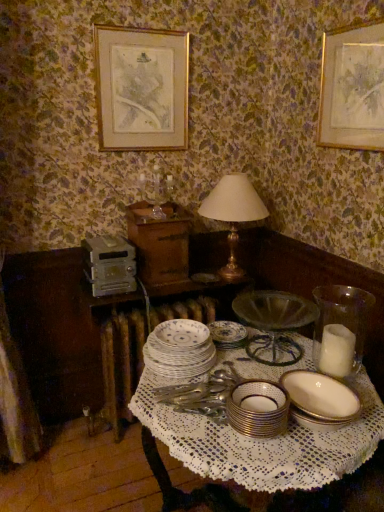
You are a GUI agent. You are given a task and a screenshot of the screen. Output one action in this format:
    pyautogui.click(x=<x>, y=<y>)
    Task: Click on the free space in front of gold metallic bowl at center, acting as the third tableware starting from the back
    Image resolution: width=384 pixels, height=512 pixels.
    Given the screenshot: What is the action you would take?
    pyautogui.click(x=269, y=464)